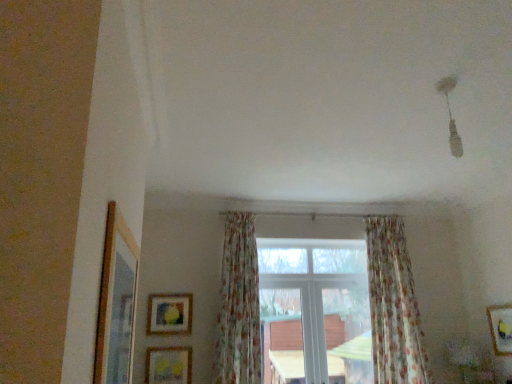
Measure the distance between point (121, 362) and camera.

Point (121, 362) is 1.63 meters away from camera.

This screenshot has width=512, height=384. Describe the element at coordinates (314, 312) in the screenshot. I see `white plastic window at center` at that location.

Locate an element on the screen. Image resolution: width=512 pixels, height=384 pixels. wooden matte picture frame at lower left, the fourth picture frame from the right is located at coordinates pyautogui.click(x=169, y=314).

Image resolution: width=512 pixels, height=384 pixels. What do you see at coordinates (501, 328) in the screenshot? I see `wooden framed picture at lower right, the second picture frame in the bottom-to-top sequence` at bounding box center [501, 328].

What do you see at coordinates (393, 306) in the screenshot? I see `floral fabric curtain at center, which is counted as the 1th curtain, starting from the right` at bounding box center [393, 306].

This screenshot has height=384, width=512. I want to click on wooden picture frame at left, the 4th picture frame from the back, so click(x=116, y=302).

Looking at this image, is floral fabric curtain at center, marked as the 2th curtain in a left-to-right arrangement, bigger or smaller than wooden framed picture at lower right, positioned as the third picture frame in top-to-bottom order?

In the image, floral fabric curtain at center, marked as the 2th curtain in a left-to-right arrangement, appears to be larger than wooden framed picture at lower right, positioned as the third picture frame in top-to-bottom order.

Where is `curtain behind the wooden framed picture at lower right, which ranks as the 2th picture frame in front-to-back order`? This screenshot has height=384, width=512. curtain behind the wooden framed picture at lower right, which ranks as the 2th picture frame in front-to-back order is located at coordinates pyautogui.click(x=393, y=306).

Is floral fabric curtain at center, marked as the 2th curtain in a left-to-right arrangement, positioned behind wooden framed picture at lower right, which ranks as the 2th picture frame in front-to-back order?

Yes, the depth of floral fabric curtain at center, marked as the 2th curtain in a left-to-right arrangement, is greater than that of wooden framed picture at lower right, which ranks as the 2th picture frame in front-to-back order.

Can you see floral fabric curtain at center, marked as the 2th curtain in a left-to-right arrangement, touching wooden framed picture at lower right, the 3th picture frame in the back-to-front sequence?

floral fabric curtain at center, marked as the 2th curtain in a left-to-right arrangement, is not next to wooden framed picture at lower right, the 3th picture frame in the back-to-front sequence, and they're not touching.

From the image's perspective, would you say floral fabric curtain at center, arranged as the 1th curtain when viewed from the left, is positioned over matte yellow picture frame at lower center, the third picture frame in the front-to-back sequence?

Yes.

In the image, is floral fabric curtain at center, arranged as the 1th curtain when viewed from the left, on the left side or the right side of matte yellow picture frame at lower center, positioned as the 3th picture frame in right-to-left order?

floral fabric curtain at center, arranged as the 1th curtain when viewed from the left, is positioned on matte yellow picture frame at lower center, positioned as the 3th picture frame in right-to-left order,'s right side.

From the picture: Is floral fabric curtain at center, arranged as the 1th curtain when viewed from the left, thinner than matte yellow picture frame at lower center, the third picture frame in the front-to-back sequence?

No.

Looking at this image, is white plastic window at center to the left of floral fabric curtain at center, the second curtain when ordered from right to left, from the viewer's perspective?

Incorrect, white plastic window at center is not on the left side of floral fabric curtain at center, the second curtain when ordered from right to left.

The height and width of the screenshot is (384, 512). I want to click on curtain to the left of white plastic window at center, so [238, 305].

Is white plastic window at center next to floral fabric curtain at center, the second curtain when ordered from right to left, and touching it?

white plastic window at center is not next to floral fabric curtain at center, the second curtain when ordered from right to left, and they're not touching.

From the picture: Is floral fabric curtain at center, arranged as the 1th curtain when viewed from the left, at the back of white plastic window at center?

white plastic window at center does not have its back to floral fabric curtain at center, arranged as the 1th curtain when viewed from the left.

Considering the sizes of objects wooden matte picture frame at lower left, which is the first picture frame in back-to-front order, and white plastic window at center in the image provided, who is taller, wooden matte picture frame at lower left, which is the first picture frame in back-to-front order, or white plastic window at center?

white plastic window at center.

Which object is thinner, wooden matte picture frame at lower left, the 4th picture frame viewed from the front, or white plastic window at center?

wooden matte picture frame at lower left, the 4th picture frame viewed from the front.

Locate an element on the screen. The width and height of the screenshot is (512, 384). window positioned vertically above the wooden matte picture frame at lower left, which is the 3th picture frame from bottom to top (from a real-world perspective) is located at coordinates (314, 312).

Considering the positions of point (346, 251) and point (115, 218), is point (346, 251) closer or farther from the camera than point (115, 218)?

Point (346, 251) is farther from the camera than point (115, 218).

From the picture: Is white plastic window at center looking in the opposite direction of wooden picture frame at left, the 4th picture frame from the back?

That's not correct — white plastic window at center is not looking away from wooden picture frame at left, the 4th picture frame from the back.

How different are the orientations of white plastic window at center and wooden picture frame at left, the 1th picture frame when ordered from top to bottom, in degrees?

The facing directions of white plastic window at center and wooden picture frame at left, the 1th picture frame when ordered from top to bottom, are 90.2 degrees apart.

In the scene shown: Is white plastic window at center next to wooden picture frame at left, the 2th picture frame viewed from the right, and touching it?

No, white plastic window at center is not beside wooden picture frame at left, the 2th picture frame viewed from the right.

Which object is wider, wooden matte picture frame at lower left, which is the second picture frame in top-to-bottom order, or floral fabric curtain at center, marked as the 2th curtain in a left-to-right arrangement?

floral fabric curtain at center, marked as the 2th curtain in a left-to-right arrangement, is wider.

Is wooden matte picture frame at lower left, the fourth picture frame from the right, aimed at floral fabric curtain at center, marked as the 2th curtain in a left-to-right arrangement?

No, wooden matte picture frame at lower left, the fourth picture frame from the right, does not turn towards floral fabric curtain at center, marked as the 2th curtain in a left-to-right arrangement.

Can you tell me how much wooden matte picture frame at lower left, which is the 3th picture frame from bottom to top, and floral fabric curtain at center, marked as the 2th curtain in a left-to-right arrangement, differ in facing direction?

The angular difference between wooden matte picture frame at lower left, which is the 3th picture frame from bottom to top, and floral fabric curtain at center, marked as the 2th curtain in a left-to-right arrangement, is 1.71 degrees.

Is wooden picture frame at left, the third picture frame when ordered from left to right, with wooden matte picture frame at lower left, which is the 3th picture frame from bottom to top?

No, wooden picture frame at left, the third picture frame when ordered from left to right, is not touching wooden matte picture frame at lower left, which is the 3th picture frame from bottom to top.

Between wooden picture frame at left, which is counted as the fourth picture frame, starting from the bottom, and wooden matte picture frame at lower left, which is the second picture frame in top-to-bottom order, which one has smaller size?

Smaller between the two is wooden matte picture frame at lower left, which is the second picture frame in top-to-bottom order.

Between wooden picture frame at left, the third picture frame when ordered from left to right, and wooden matte picture frame at lower left, which is the first picture frame in back-to-front order, which one has larger width?

wooden picture frame at left, the third picture frame when ordered from left to right.

At what (x,y) coordinates should I click in order to perform the action: click on curtain behind the wooden framed picture at lower right, positioned as the third picture frame in top-to-bottom order. Please return your answer as a coordinate pair (x, y). The image size is (512, 384). Looking at the image, I should click on (393, 306).

The image size is (512, 384). I want to click on the 1st curtain to the right of the matte yellow picture frame at lower center, marked as the 2th picture frame in a left-to-right arrangement, counting from the anchor's position, so click(238, 305).

Considering their positions, is floral fabric curtain at center, marked as the 2th curtain in a left-to-right arrangement, positioned closer to wooden framed picture at lower right, the first picture frame from the right, than wooden picture frame at left, the 4th picture frame from the back?

floral fabric curtain at center, marked as the 2th curtain in a left-to-right arrangement, is positioned closer to the anchor wooden framed picture at lower right, the first picture frame from the right.

Estimate the real-world distances between objects in this image. Which object is closer to matte yellow picture frame at lower center, the 1th picture frame from the bottom, wooden framed picture at lower right, the 3th picture frame in the back-to-front sequence, or wooden picture frame at left, the third picture frame when ordered from left to right?

wooden picture frame at left, the third picture frame when ordered from left to right.

Which object lies nearer to the anchor point floral fabric curtain at center, the second curtain when ordered from right to left, white plastic window at center or wooden picture frame at left, the 2th picture frame viewed from the right?

The object closer to floral fabric curtain at center, the second curtain when ordered from right to left, is white plastic window at center.

Based on their spatial positions, is floral fabric curtain at center, arranged as the 1th curtain when viewed from the left, or matte yellow picture frame at lower center, marked as the 2th picture frame in a left-to-right arrangement, closer to wooden framed picture at lower right, positioned as the third picture frame in top-to-bottom order?

floral fabric curtain at center, arranged as the 1th curtain when viewed from the left.

Estimate the real-world distances between objects in this image. Which object is further from wooden picture frame at left, the 4th picture frame from the back, matte yellow picture frame at lower center, positioned as the 3th picture frame in right-to-left order, or wooden matte picture frame at lower left, which is the second picture frame in top-to-bottom order?

The object further to wooden picture frame at left, the 4th picture frame from the back, is matte yellow picture frame at lower center, positioned as the 3th picture frame in right-to-left order.

Looking at the image, which one is located closer to wooden picture frame at left, the 1th picture frame when ordered from top to bottom, white plastic window at center or matte yellow picture frame at lower center, the third picture frame in the front-to-back sequence?

Based on the image, matte yellow picture frame at lower center, the third picture frame in the front-to-back sequence, appears to be nearer to wooden picture frame at left, the 1th picture frame when ordered from top to bottom.

Considering their positions, is floral fabric curtain at center, arranged as the 1th curtain when viewed from the left, positioned closer to floral fabric curtain at center, marked as the 2th curtain in a left-to-right arrangement, than wooden framed picture at lower right, the first picture frame from the right?

wooden framed picture at lower right, the first picture frame from the right, lies closer to floral fabric curtain at center, marked as the 2th curtain in a left-to-right arrangement, than the other object.

Which object lies further to the anchor point wooden framed picture at lower right, which ranks as the 2th picture frame in front-to-back order, wooden picture frame at left, the 1th picture frame when ordered from top to bottom, or wooden matte picture frame at lower left, the first picture frame viewed from the left?

Among the two, wooden picture frame at left, the 1th picture frame when ordered from top to bottom, is located further to wooden framed picture at lower right, which ranks as the 2th picture frame in front-to-back order.

The image size is (512, 384). Identify the location of curtain between wooden matte picture frame at lower left, which is the first picture frame in back-to-front order, and floral fabric curtain at center, marked as the 2th curtain in a left-to-right arrangement, in the horizontal direction. (238, 305).

Identify the location of picture frame between matte yellow picture frame at lower center, positioned as the 3th picture frame in right-to-left order, and wooden framed picture at lower right, which is the fourth picture frame from left to right, from left to right. (116, 302).

What are the coordinates of `curtain situated between matte yellow picture frame at lower center, the third picture frame in the front-to-back sequence, and floral fabric curtain at center, marked as the 2th curtain in a left-to-right arrangement, from left to right` in the screenshot? It's located at (238, 305).

I want to click on curtain between white plastic window at center and wooden framed picture at lower right, the first picture frame from the right, so click(x=393, y=306).